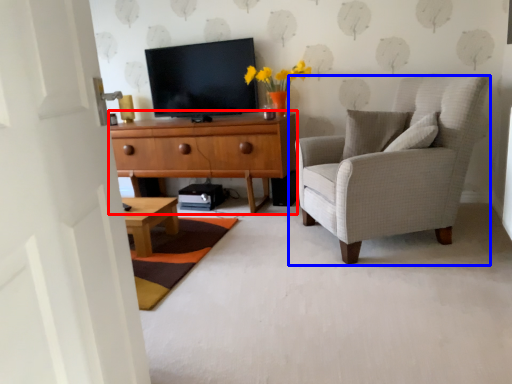
Question: Which object is closer to the camera taking this photo, cabinetry (highlighted by a red box) or chair (highlighted by a blue box)?

Choices:
 (A) cabinetry
 (B) chair

Answer: (B)